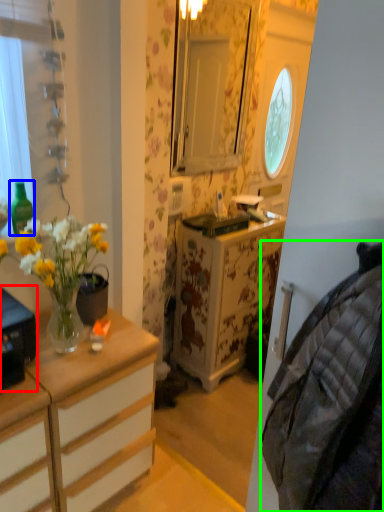
Question: Estimate the real-world distances between objects in this image. Which object is closer to desk (highlighted by a red box), bottle (highlighted by a blue box) or material (highlighted by a green box)?

Choices:
 (A) bottle
 (B) material

Answer: (A)